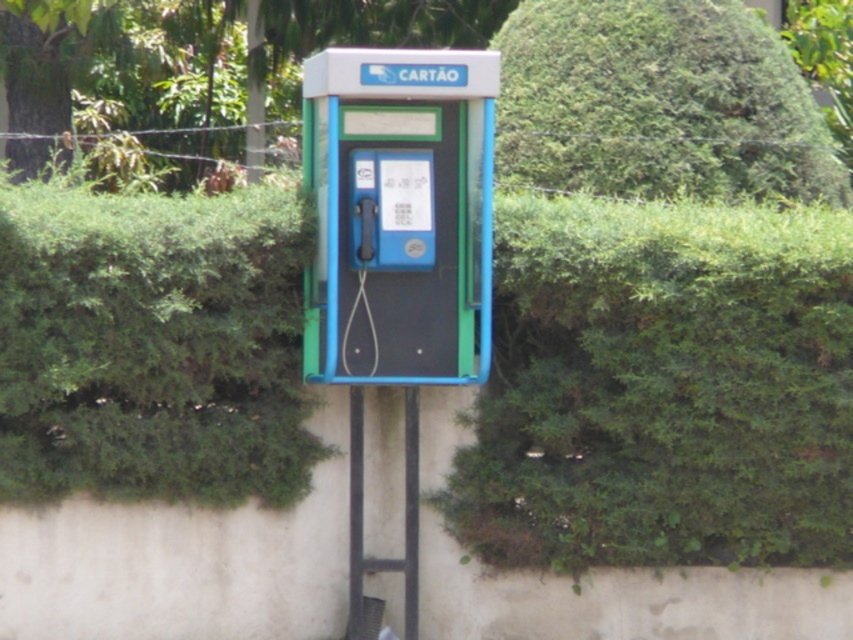
You are a delivery person with a 4 feet wide cart. You need to pass between the blue plastic phone box at center and the green leafy hedge at upper center. Can your cart fit through the space between them?

The blue plastic phone box at center and the green leafy hedge at upper center are 3.72 feet apart. Since your cart is 4 feet wide, it cannot fit through the space between them as the distance is narrower than the cart.

You are designing a new garden layout and want to place a decorative statue between the blue plastic phone box at center and the green leafy hedge at upper center. Given that the statue requires 1.5 meters of space, will there be enough room between them?

The blue plastic phone box at center is narrower than the green leafy hedge at upper center. However, the description only provides information about their widths, not the distance between them. Therefore, it is impossible to determine if there is enough space for the statue based on the given details.

You are standing in front of the blue plastic phone box at center and the green leafy hedge at upper center. Which object is located more to the left side?

The blue plastic phone box at center is positioned on the left side of the green leafy hedge at upper center, so it is more to the left.